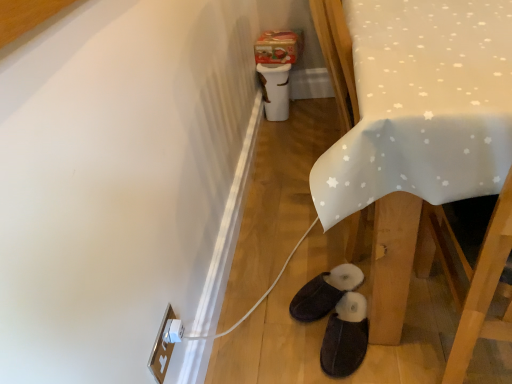
Where is `vacant point to the left of black suede slippers at lower center, which is counted as the 1th footwear, starting from the back`? The width and height of the screenshot is (512, 384). vacant point to the left of black suede slippers at lower center, which is counted as the 1th footwear, starting from the back is located at coordinates (269, 307).